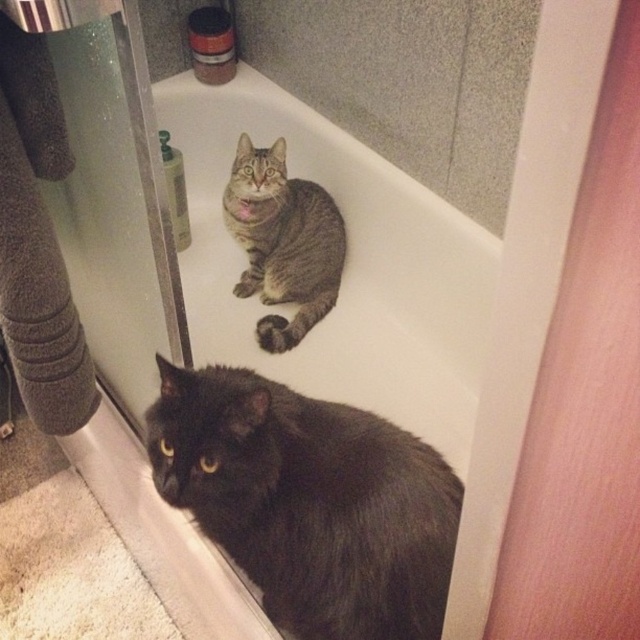
Between white glossy bathtub at upper center and tabby fur cat at center, which one is positioned lower?

white glossy bathtub at upper center is below.

Can you confirm if white glossy bathtub at upper center is bigger than tabby fur cat at center?

Correct, white glossy bathtub at upper center is larger in size than tabby fur cat at center.

Find the location of a particular element. white glossy bathtub at upper center is located at coordinates (346, 268).

Find the location of a particular element. The width and height of the screenshot is (640, 640). white glossy bathtub at upper center is located at coordinates (346, 268).

Between tabby fur cat at upper center and tabby fur cat at center, which one is positioned higher?

tabby fur cat at center is higher up.

Does point (435, 474) lie behind point (296, 336)?

No, (435, 474) is in front of (296, 336).

Find the location of `tabby fur cat at upper center`. tabby fur cat at upper center is located at coordinates (308, 500).

Who is more forward, [403,353] or [404,499]?

Point [404,499]

Is point (310, 173) farther from camera compared to point (177, 422)?

Yes.

Who is more distant from viewer, (417, 340) or (419, 518)?

Positioned behind is point (417, 340).

Identify the location of white glossy bathtub at upper center. (346, 268).